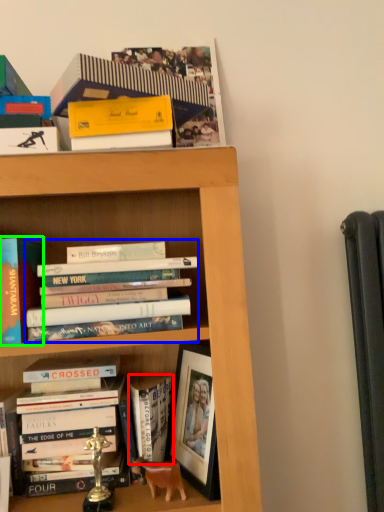
Question: Based on their relative distances, which object is nearer to book (highlighted by a red box)? Choose from book (highlighted by a blue box) and book (highlighted by a green box).

Choices:
 (A) book
 (B) book

Answer: (A)